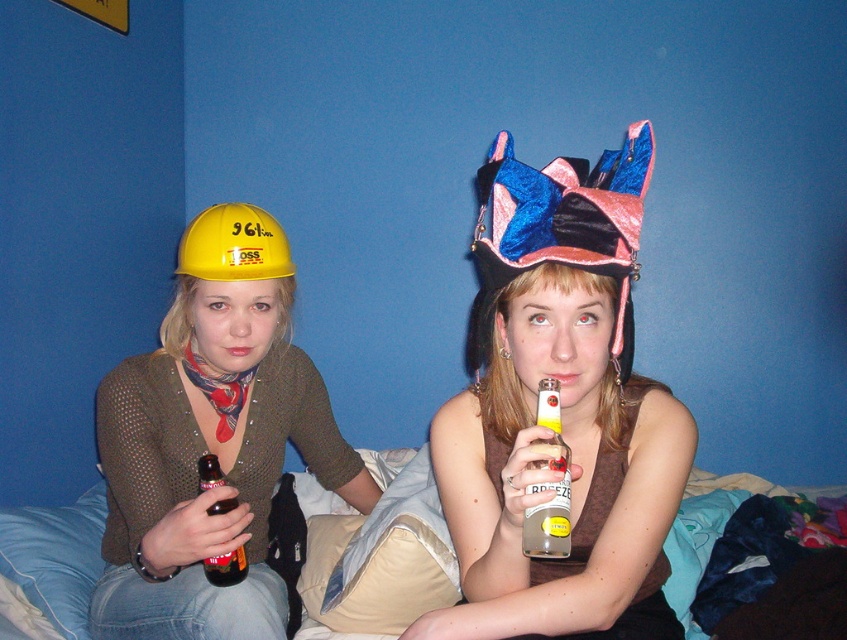
You are standing in front of the image and see the point at coordinates (599, 260). If you want to place a 12 inch ruler horizontally from your current position to reach that point, will the ruler be long enough?

The point at coordinates (599, 260) is 37.43 inches away from the viewer. Since the ruler is only 12 inches long, it will not be long enough to reach the point.

You are an architect designing a new building and need to ensure safety equipment is visible. You observe the matte yellow hard hat at left and the velvet pink and blue hat at center in the image. Which hat is positioned lower in the scene?

The matte yellow hard hat at left is located below the velvet pink and blue hat at center, so it is positioned lower in the scene.